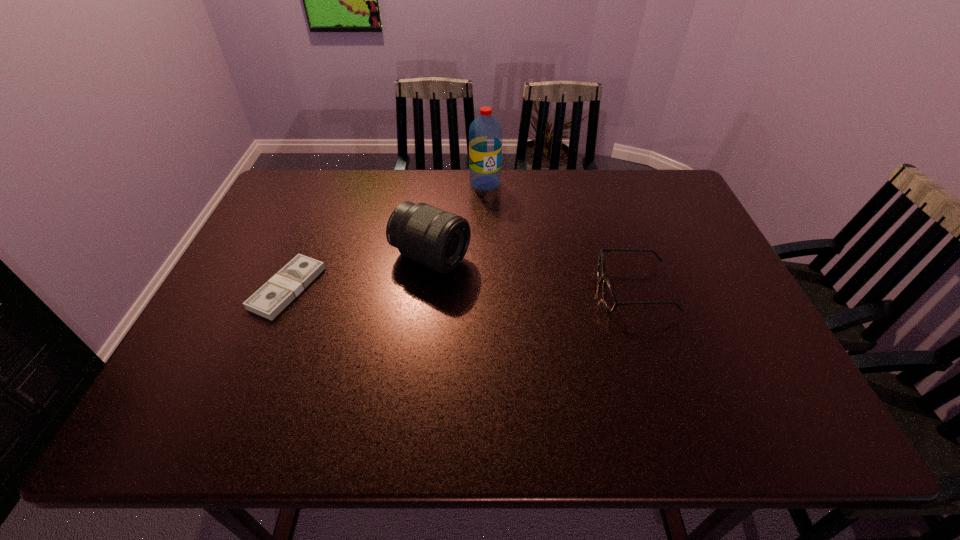
Image resolution: width=960 pixels, height=540 pixels. Identify the location of unoccupied area between the tallest object and the rightmost object. (560, 237).

I want to click on the second closest object to the rightmost object, so click(485, 133).

Locate an element on the screen. object that is the closest to the tallest object is located at coordinates (438, 239).

Find the location of a particular element. vacant space that satisfies the following two spatial constraints: 1. on the front side of the spectacles; 2. on the front-facing side of the third shortest object is located at coordinates (427, 291).

The width and height of the screenshot is (960, 540). I want to click on vacant area in the image that satisfies the following two spatial constraints: 1. on the back side of the tallest object; 2. on the left side of the leftmost object, so click(x=332, y=183).